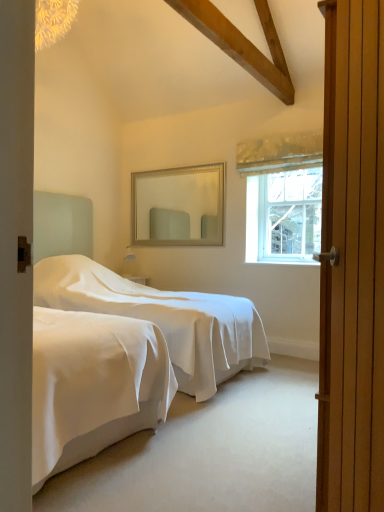
Question: From a real-world perspective, is white smooth bed at center physically above clear glass window at upper right?

Choices:
 (A) yes
 (B) no

Answer: (B)

Question: From a real-world perspective, is white smooth bed at center beneath clear glass window at upper right?

Choices:
 (A) yes
 (B) no

Answer: (A)

Question: Are white smooth bed at center and clear glass window at upper right making contact?

Choices:
 (A) no
 (B) yes

Answer: (A)

Question: Does white smooth bed at center appear on the right side of clear glass window at upper right?

Choices:
 (A) yes
 (B) no

Answer: (B)

Question: Is white smooth bed at center shorter than clear glass window at upper right?

Choices:
 (A) yes
 (B) no

Answer: (B)

Question: Is white smooth bed at center wider than clear glass window at upper right?

Choices:
 (A) no
 (B) yes

Answer: (B)

Question: Considering the relative sizes of wooden door at right and clear glass window at upper right in the image provided, is wooden door at right bigger than clear glass window at upper right?

Choices:
 (A) no
 (B) yes

Answer: (B)

Question: Is wooden door at right shorter than clear glass window at upper right?

Choices:
 (A) no
 (B) yes

Answer: (A)

Question: Does wooden door at right have a lesser width compared to clear glass window at upper right?

Choices:
 (A) no
 (B) yes

Answer: (A)

Question: Considering the relative positions of wooden door at right and clear glass window at upper right in the image provided, is wooden door at right to the left of clear glass window at upper right from the viewer's perspective?

Choices:
 (A) yes
 (B) no

Answer: (A)

Question: Is wooden door at right facing towards clear glass window at upper right?

Choices:
 (A) yes
 (B) no

Answer: (B)

Question: Can you confirm if wooden door at right is wider than clear glass window at upper right?

Choices:
 (A) yes
 (B) no

Answer: (A)

Question: Can you confirm if clear glass window at upper right is positioned to the right of wooden door at right?

Choices:
 (A) yes
 (B) no

Answer: (A)